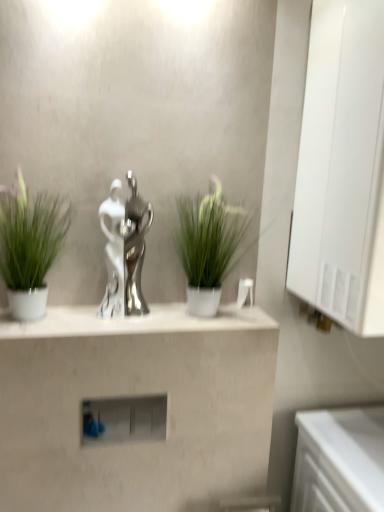
At what (x,y) coordinates should I click in order to perform the action: click on free space above satin silver statue at center (from a real-world perspective). Please return your answer as a coordinate pair (x, y). This screenshot has width=384, height=512. Looking at the image, I should click on (157, 316).